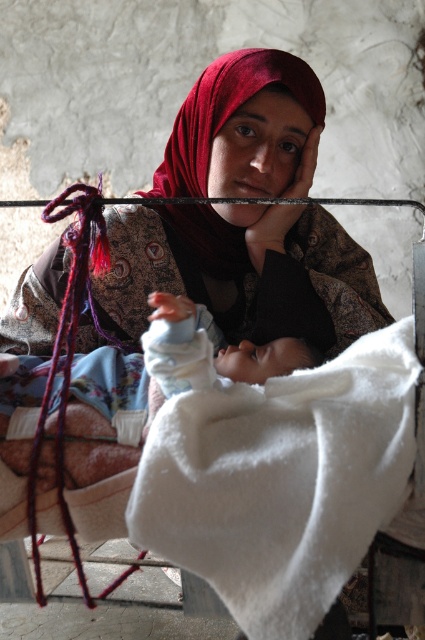
You are a photographer adjusting lighting for a portrait. You need to ensure both the velvet red headscarf at center and the light blue fabric at center are well lit. Which object should you focus on first to avoid shadows, considering their sizes?

The velvet red headscarf at center is taller than the light blue fabric at center, so you should focus on lighting the taller velvet red headscarf at center first to avoid casting shadows over the shorter light blue fabric at center.

You are a photographer adjusting your camera to focus on the velvet red headscarf at center and the light blue fabric at center. Which object will appear closer to you in the photo?

The velvet red headscarf at center will appear closer to you in the photo because it is positioned further to the viewer than the light blue fabric at center.

You are a photographer trying to capture the baby in the image. Since the white fluffy blanket at center and the light blue fabric at center are both at the center, which one is wider?

The white fluffy blanket at center is wider than the light blue fabric at center because its width surpasses the light blue fabric at center.